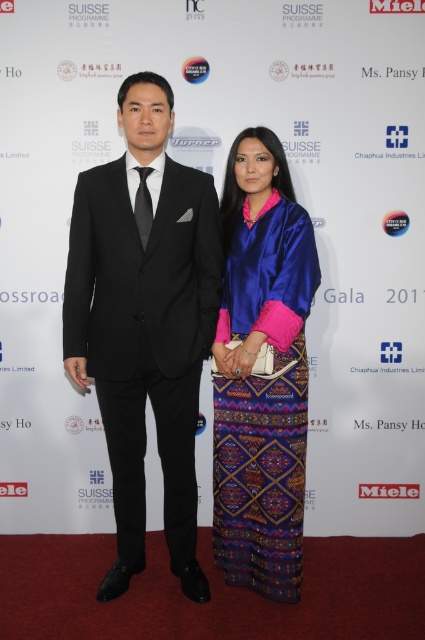
Is black satin suit at left above silky blue dress at center?

Yes, black satin suit at left is above silky blue dress at center.

Identify the location of black satin suit at left. (144, 321).

Does point (107, 340) lie in front of point (226, 200)?

That is True.

Image resolution: width=425 pixels, height=640 pixels. Identify the location of black satin suit at left. (144, 321).